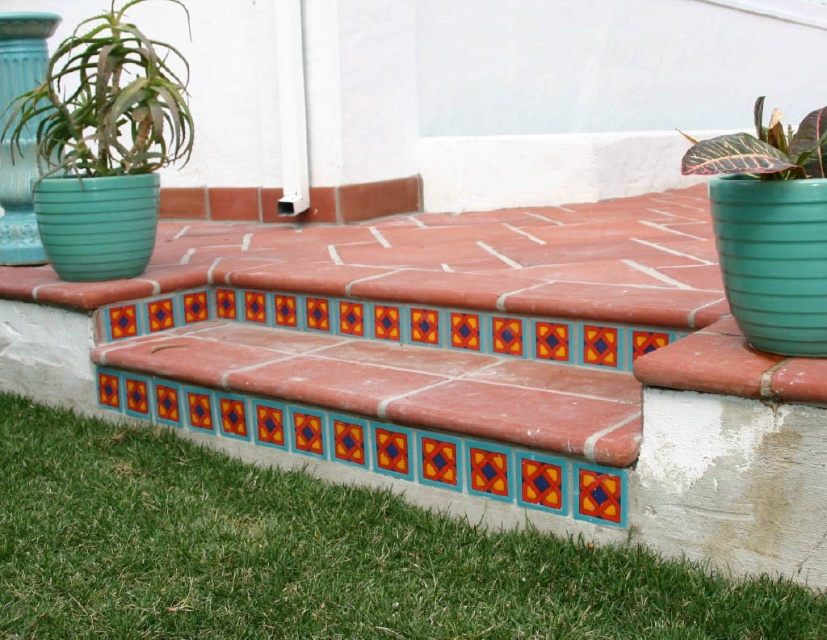
Consider the image. You are standing on the steps looking down towards the base. You notice the green grass at lower left and the multicolored tile at center. Which object is located closer to the base of the steps?

The green grass at lower left is positioned under the multicolored tile at center, so the green grass at lower left is closer to the base of the steps.

You are planning to place a small potted plant that is 20 cm in width on the terracotta tile bench at center. The green matte pot at upper left is currently empty. Which object has enough space to accommodate the potted plant?

The terracotta tile bench at center is wider than the green matte pot at upper left, so it has enough space to accommodate the 20 cm wide potted plant.